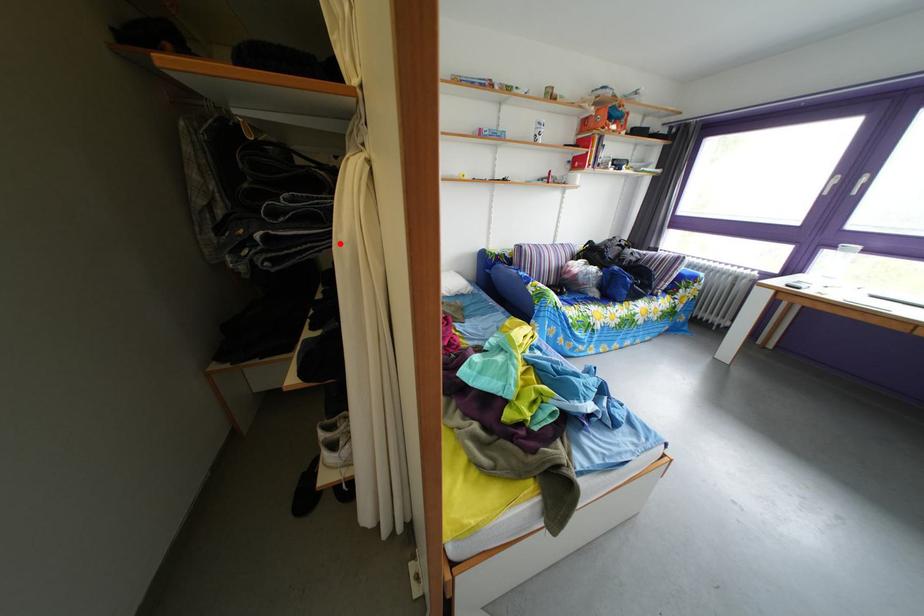
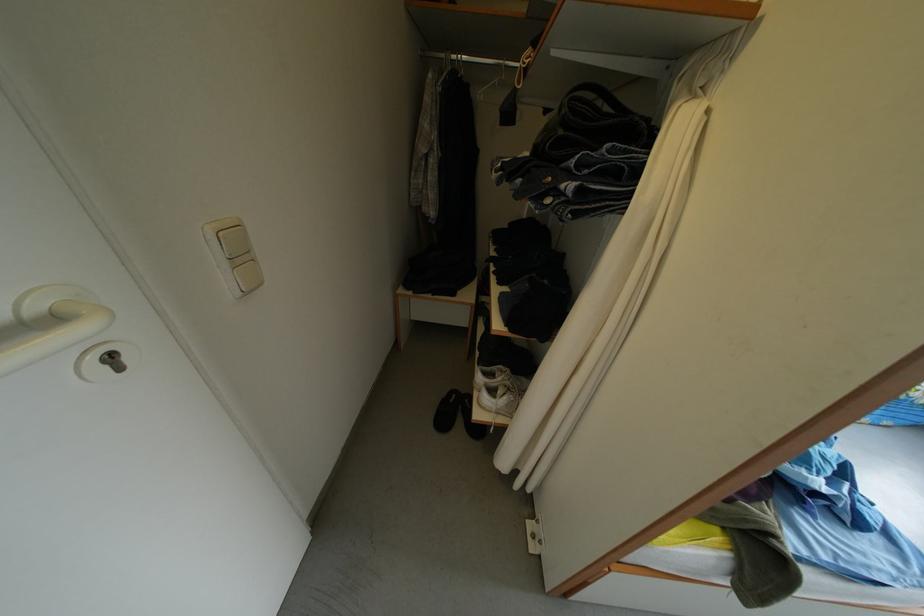
Where in the second image is the point corresponding to the highlighted location from the first image?

(639, 204)